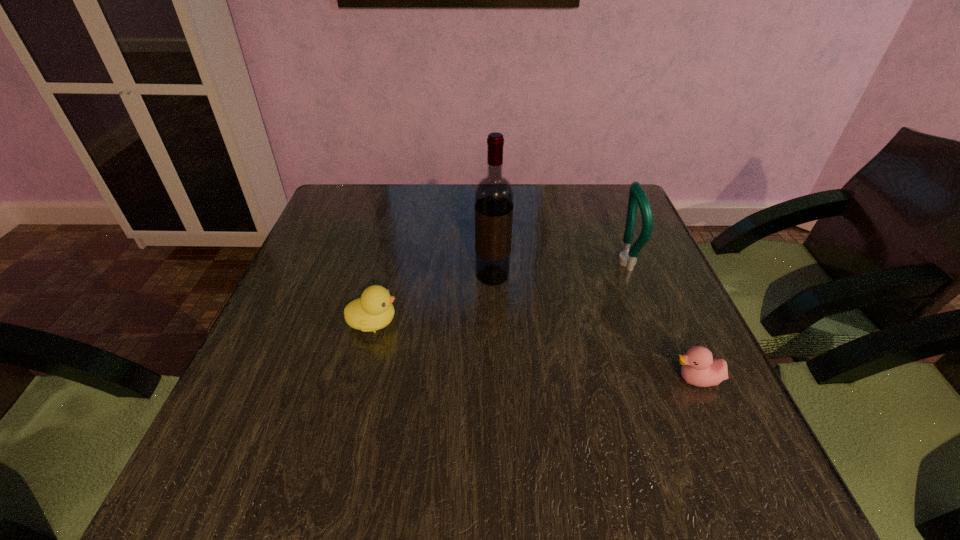
What are the coordinates of `free space that is in between the nearer duckling and the bottle opener` in the screenshot? It's located at (660, 321).

At what (x,y) coordinates should I click in order to perform the action: click on free space between the bottle opener and the farther duckling. Please return your answer as a coordinate pair (x, y). Image resolution: width=960 pixels, height=540 pixels. Looking at the image, I should click on (498, 292).

Where is `object that is the closest to the tallest object`? This screenshot has width=960, height=540. object that is the closest to the tallest object is located at coordinates (373, 311).

I want to click on object that stands as the third closest to the second nearest object, so click(699, 368).

Locate an element on the screen. free space that satisfies the following two spatial constraints: 1. at the jaws of the second tallest object; 2. on the front side of the tallest object is located at coordinates (629, 276).